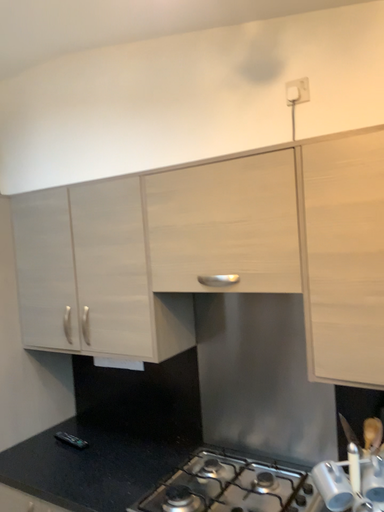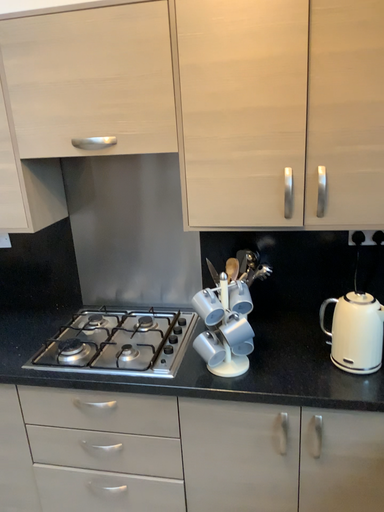
Question: Which way did the camera rotate in the video?

Choices:
 (A) rotated left
 (B) rotated right

Answer: (B)